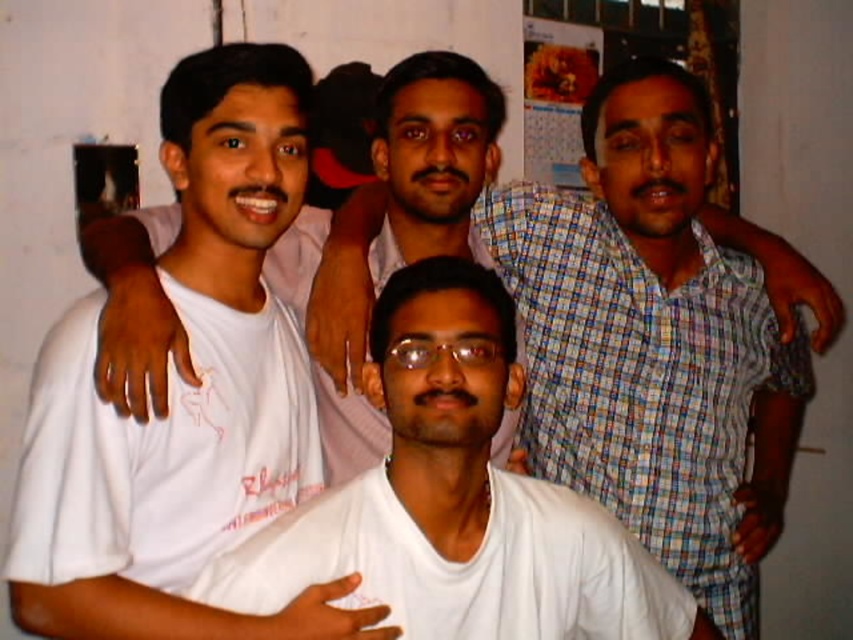
Is point (325, 532) closer to viewer compared to point (399, 356)?

Yes, it is.

This screenshot has height=640, width=853. Describe the element at coordinates (457, 506) in the screenshot. I see `white matte shirt at center` at that location.

The image size is (853, 640). Find the location of `white matte shirt at center`. white matte shirt at center is located at coordinates pyautogui.click(x=457, y=506).

Does white matte t-shirt at left have a larger size compared to white matte shirt at center?

Correct, white matte t-shirt at left is larger in size than white matte shirt at center.

From the picture: Is white matte t-shirt at left thinner than white matte shirt at center?

Indeed, white matte t-shirt at left has a lesser width compared to white matte shirt at center.

Who is more forward, (259,122) or (430,560)?

Point (430,560) is more forward.

This screenshot has width=853, height=640. What are the coordinates of `white matte t-shirt at left` in the screenshot? It's located at (186, 392).

Which is below, white matte t-shirt at left or transparent plastic glasses at center?

Positioned lower is transparent plastic glasses at center.

What are the coordinates of `white matte t-shirt at left` in the screenshot? It's located at (186, 392).